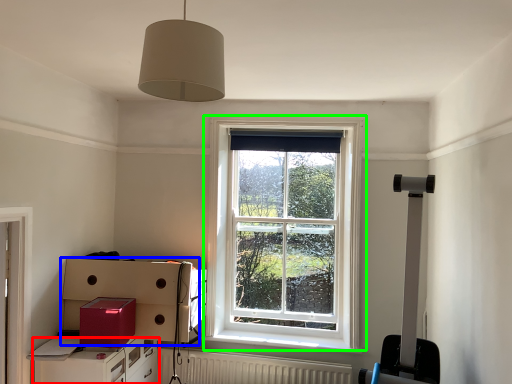
Question: Which object is positioned closest to cabinetry (highlighted by a red box)? Select from cardboard box (highlighted by a blue box) and window (highlighted by a green box).

Choices:
 (A) cardboard box
 (B) window

Answer: (A)